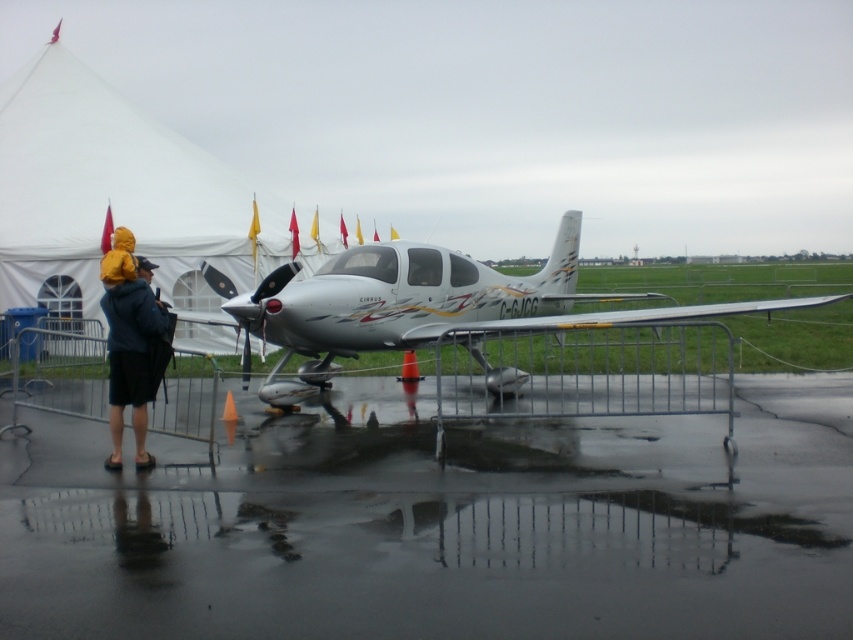
You are standing at the point where the image was taken. The white fabric tent at upper left is represented by point [115,196]. If you want to walk towards the white fabric tent at upper left, in which direction should you move relative to your current position?

The white fabric tent at upper left is located at point [115,196]. Since this point is in the upper left of the image, you should move towards the upper left direction to reach it.